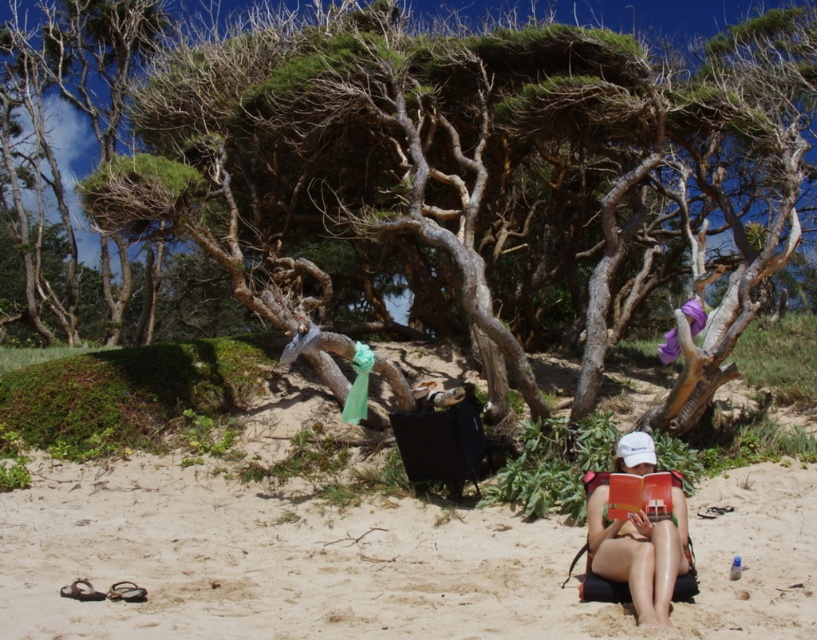
Measure the distance from beige sandy beach at lower center to tan skin bikini at lower right.

beige sandy beach at lower center is 25.19 inches away from tan skin bikini at lower right.

This screenshot has width=817, height=640. What are the coordinates of `beige sandy beach at lower center` in the screenshot? It's located at (368, 557).

You are a GUI agent. You are given a task and a screenshot of the screen. Output one action in this format:
    pyautogui.click(x=<x>, y=<y>)
    Task: Click on the beige sandy beach at lower center
    
    Given the screenshot: What is the action you would take?
    pyautogui.click(x=368, y=557)

Which of these two, brown textured tree at center or tan skin bikini at lower right, stands taller?

Standing taller between the two is brown textured tree at center.

Does point (525, 262) come farther from viewer compared to point (627, 532)?

Yes, point (525, 262) is farther from viewer.

Does point (496, 403) lie behind point (677, 564)?

Yes, it is.

At what (x,y) coordinates should I click in order to perform the action: click on brown textured tree at center. Please return your answer as a coordinate pair (x, y). The height and width of the screenshot is (640, 817). Looking at the image, I should click on (462, 177).

Which of these two, brown textured tree at center or beige sandy beach at lower center, stands taller?

brown textured tree at center

Is brown textured tree at center positioned at the back of beige sandy beach at lower center?

Yes.

Is point (735, 337) less distant than point (221, 556)?

No, (735, 337) is further to viewer.

I want to click on brown textured tree at center, so click(462, 177).